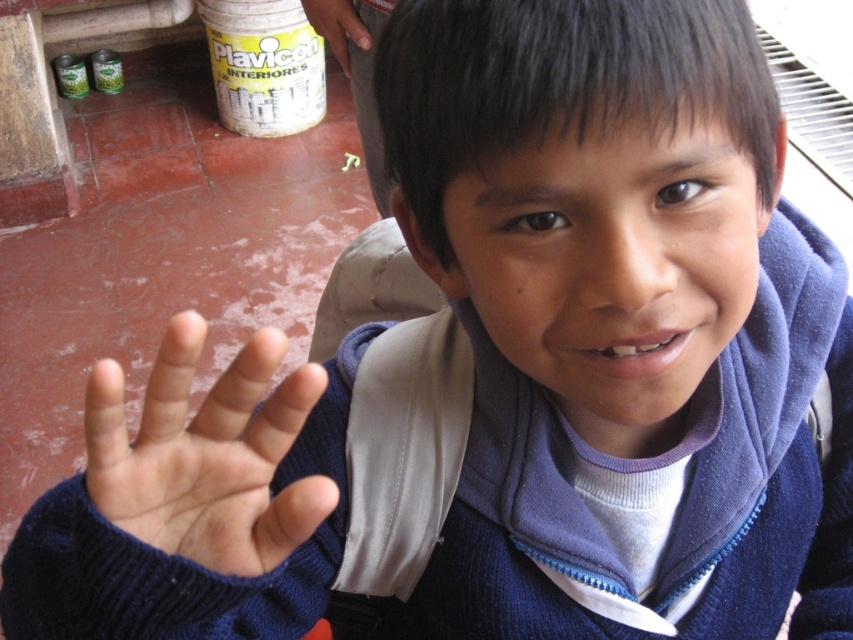
Is light skin/soft skin palm at center positioned at the back of matte plastic can at upper left?

No, it is in front of matte plastic can at upper left.

Can you confirm if light skin/soft skin palm at center is taller than matte plastic can at upper left?

Indeed, light skin/soft skin palm at center has a greater height compared to matte plastic can at upper left.

You are a GUI agent. You are given a task and a screenshot of the screen. Output one action in this format:
    pyautogui.click(x=<x>, y=<y>)
    Task: Click on the light skin/soft skin palm at center
    This screenshot has width=853, height=640.
    Given the screenshot: What is the action you would take?
    pyautogui.click(x=206, y=454)